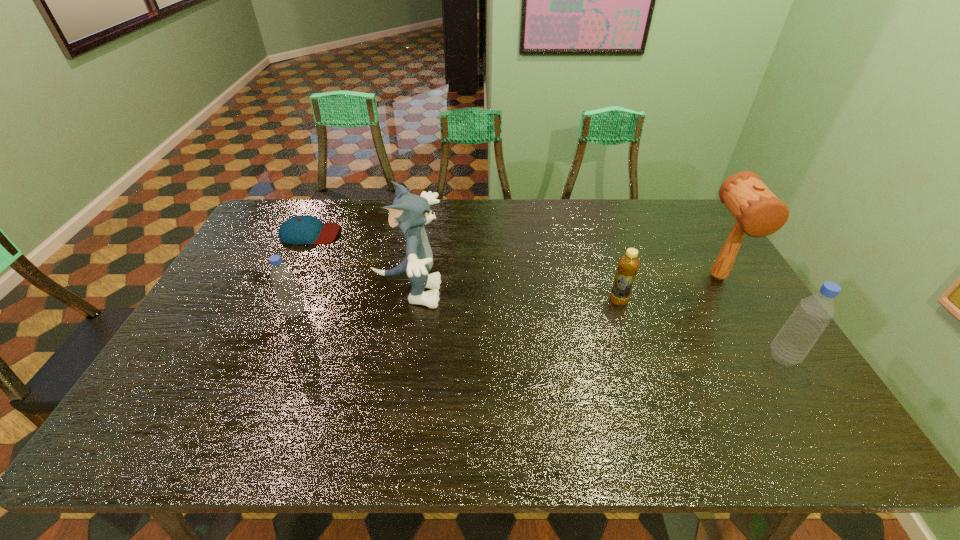
The height and width of the screenshot is (540, 960). I want to click on the leftmost bottle, so click(x=289, y=296).

Locate an element on the screen. the rightmost bottle is located at coordinates (793, 342).

Find the location of a particular element. This screenshot has height=540, width=960. the nearest bottle is located at coordinates (793, 342).

At what (x,y) coordinates should I click in order to perform the action: click on the fourth object from right to left. Please return your answer as a coordinate pair (x, y). The image size is (960, 540). Looking at the image, I should click on (410, 212).

The width and height of the screenshot is (960, 540). In order to click on the shortest object in this screenshot , I will do `click(299, 230)`.

Where is `the farthest object`? The width and height of the screenshot is (960, 540). the farthest object is located at coordinates (299, 230).

Find the location of `the second bottle from right to left`. the second bottle from right to left is located at coordinates (628, 265).

This screenshot has height=540, width=960. Find the location of `mallet`. mallet is located at coordinates (758, 212).

The image size is (960, 540). What are the coordinates of `free location located 0.310m on the back of the leftmost bottle` in the screenshot? It's located at (326, 240).

This screenshot has height=540, width=960. What are the coordinates of `vacant space situated on the back of the nearest object` in the screenshot? It's located at (717, 253).